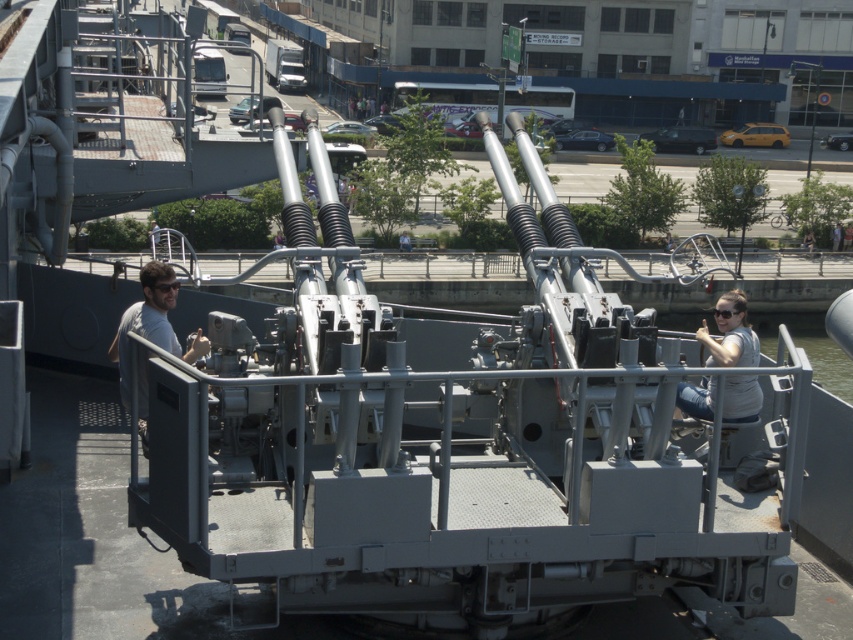
Is gray metallic gun turret at center taller than gray matte shirt at left?

No.

Is gray metallic gun turret at center wider than gray matte shirt at left?

Incorrect, gray metallic gun turret at center's width does not surpass gray matte shirt at left's.

Who is more forward, (283, 314) or (158, 314)?

Positioned in front is point (283, 314).

Identify the location of gray metallic gun turret at center. Image resolution: width=853 pixels, height=640 pixels. (456, 448).

Which of these two, gray metallic gun turret at center or gray fabric shirt at center, stands shorter?

Standing shorter between the two is gray metallic gun turret at center.

Which is above, gray metallic gun turret at center or gray fabric shirt at center?

gray metallic gun turret at center

Which is behind, point (495, 378) or point (750, 419)?

Positioned behind is point (750, 419).

At what (x,y) coordinates should I click in order to perform the action: click on gray metallic gun turret at center. Please return your answer as a coordinate pair (x, y). Looking at the image, I should click on (456, 448).

Does gray fabric shirt at center have a larger size compared to gray matte shirt at left?

Indeed, gray fabric shirt at center has a larger size compared to gray matte shirt at left.

Which is behind, point (683, 406) or point (160, 298)?

The point (683, 406) is behind.

Describe the element at coordinates (730, 333) in the screenshot. The width and height of the screenshot is (853, 640). I see `gray fabric shirt at center` at that location.

At what (x,y) coordinates should I click in order to perform the action: click on gray fabric shirt at center. Please return your answer as a coordinate pair (x, y). The image size is (853, 640). Looking at the image, I should click on (730, 333).